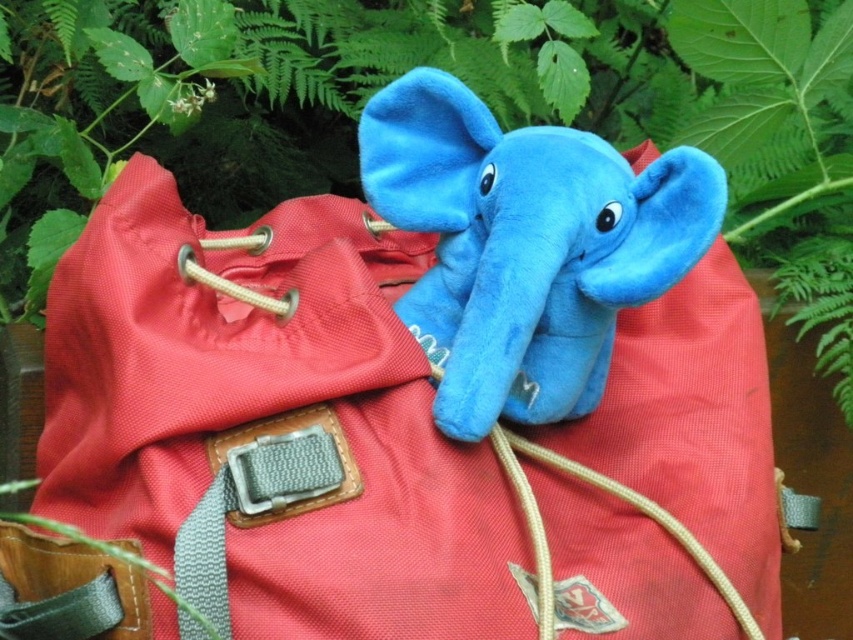
Who is more forward, [97,365] or [244,36]?

Point [97,365] is in front.

Measure the distance between coral fabric backpack at center and camera.

They are 19.07 inches apart.

Find the location of a particular element. This screenshot has height=640, width=853. coral fabric backpack at center is located at coordinates (390, 440).

Where is `coral fabric backpack at center`? The width and height of the screenshot is (853, 640). coral fabric backpack at center is located at coordinates (390, 440).

Is point (744, 506) closer to camera compared to point (465, 384)?

No.

Looking at this image, can you confirm if coral fabric backpack at center is smaller than blue plush toy at center?

No.

At what (x,y) coordinates should I click in order to perform the action: click on coral fabric backpack at center. Please return your answer as a coordinate pair (x, y). The image size is (853, 640). Looking at the image, I should click on (390, 440).

I want to click on coral fabric backpack at center, so click(390, 440).

Based on the photo, does green leafy plant at upper center appear on the right side of matte beige strap at center?

Incorrect, green leafy plant at upper center is not on the right side of matte beige strap at center.

The height and width of the screenshot is (640, 853). What do you see at coordinates (466, 83) in the screenshot?
I see `green leafy plant at upper center` at bounding box center [466, 83].

Is point (334, 68) closer to camera compared to point (596, 476)?

No.

Locate an element on the screen. green leafy plant at upper center is located at coordinates (466, 83).